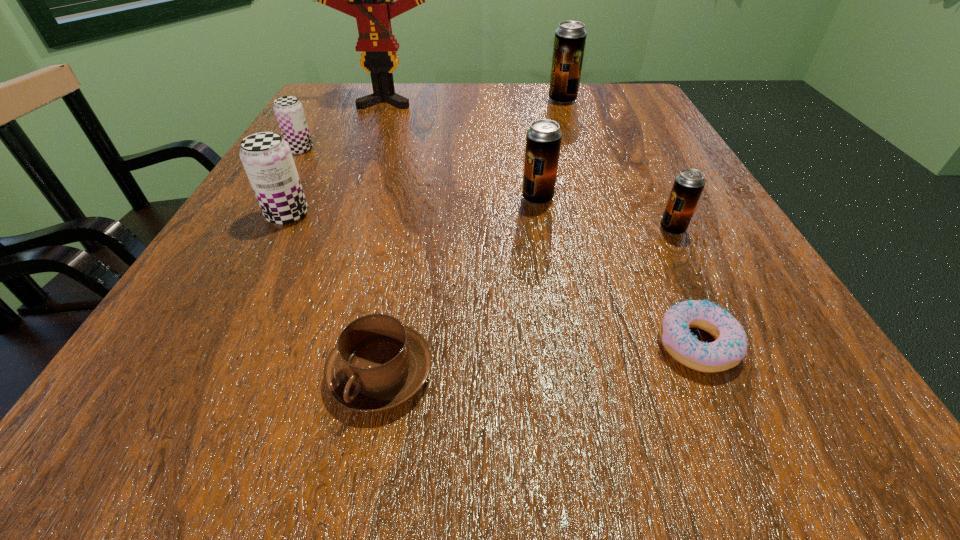
Find the location of a particular element. This screenshot has height=540, width=960. vacant space situated 0.180m on the left of the doughnut is located at coordinates (508, 345).

Find the location of a particular element. This screenshot has height=540, width=960. nutcracker that is at the far edge is located at coordinates (370, 0).

Identify the location of beer can located at the far edge. The image size is (960, 540). (570, 37).

Image resolution: width=960 pixels, height=540 pixels. In order to click on object that is at the near edge in this screenshot , I will do `click(378, 364)`.

The width and height of the screenshot is (960, 540). What are the coordinates of `nutcracker at the left edge` in the screenshot? It's located at (370, 0).

Find the location of a particular element. beer can at the right edge is located at coordinates point(688,185).

Identify the location of doughnut located at the right edge. (730, 346).

Where is `object positioned at the far left corner`? object positioned at the far left corner is located at coordinates (370, 0).

Where is `vacant space at the far edge of the desktop`? vacant space at the far edge of the desktop is located at coordinates (541, 86).

The width and height of the screenshot is (960, 540). In order to click on vacant area at the near edge in this screenshot , I will do `click(431, 428)`.